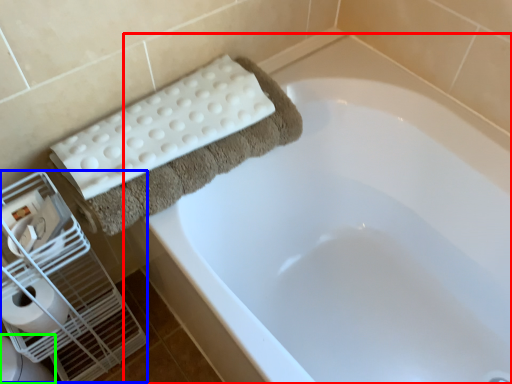
Question: Which is nearer to the bathtub (highlighted by a red box)? bird cage (highlighted by a blue box) or toilet bowl (highlighted by a green box).

Choices:
 (A) bird cage
 (B) toilet bowl

Answer: (A)